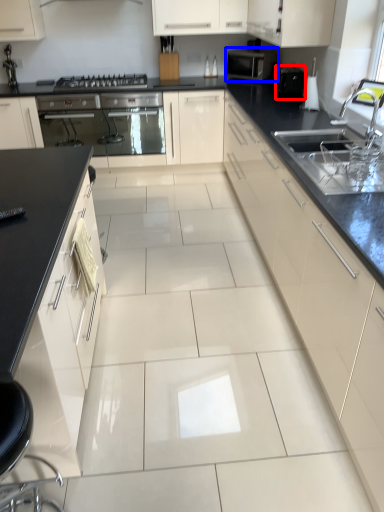
Question: Among these objects, which one is farthest to the camera, appliance (highlighted by a red box) or kitchen appliance (highlighted by a blue box)?

Choices:
 (A) appliance
 (B) kitchen appliance

Answer: (B)